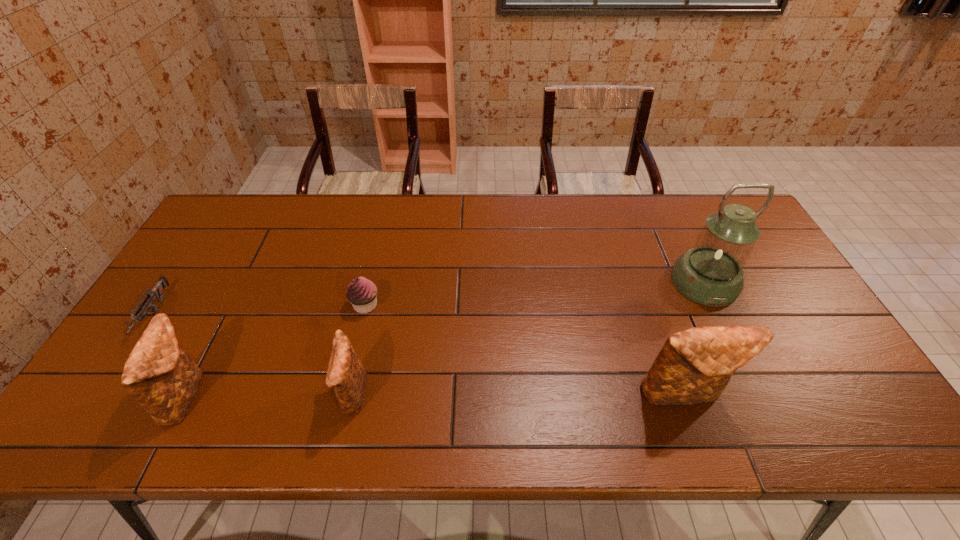
The height and width of the screenshot is (540, 960). In order to click on the second tallest clutch bag in this screenshot , I will do `click(161, 377)`.

The height and width of the screenshot is (540, 960). I want to click on the third tallest object, so click(161, 377).

Image resolution: width=960 pixels, height=540 pixels. Find the location of `the shortest clutch bag`. the shortest clutch bag is located at coordinates (346, 373).

You are a GUI agent. You are given a task and a screenshot of the screen. Output one action in this format:
    pyautogui.click(x=<x>, y=<y>)
    Task: Click on the second clutch bag from right to left
    The height and width of the screenshot is (540, 960).
    Given the screenshot: What is the action you would take?
    pyautogui.click(x=346, y=373)

Locate an element on the screen. the fifth shortest object is located at coordinates (694, 366).

At what (x,y) coordinates should I click in order to perform the action: click on the tallest clutch bag. Please return your answer as a coordinate pair (x, y). Looking at the image, I should click on (694, 366).

Identify the location of the tallest object. The width and height of the screenshot is (960, 540). (711, 273).

This screenshot has width=960, height=540. Identify the location of cupcake. (362, 293).

Locate an element on the screen. The image size is (960, 540). the shortest object is located at coordinates (156, 292).

The width and height of the screenshot is (960, 540). In order to click on the leftmost object in this screenshot , I will do `click(156, 292)`.